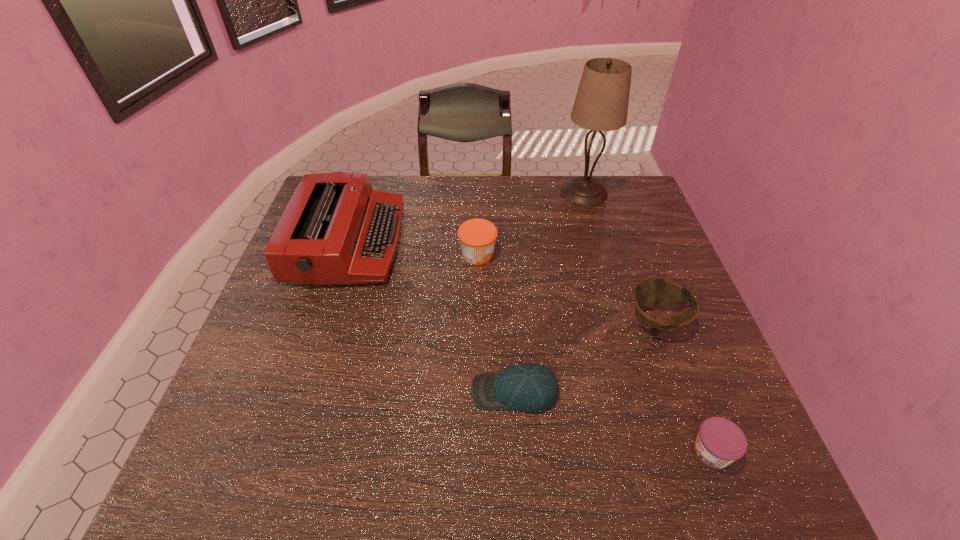
Image resolution: width=960 pixels, height=540 pixels. I want to click on vacant region at the right edge of the desktop, so click(x=676, y=346).

The image size is (960, 540). I want to click on vacant space at the near left corner of the desktop, so click(217, 471).

Where is `blank space at the far right corner`? The image size is (960, 540). blank space at the far right corner is located at coordinates (614, 179).

Identify the location of vacant area that lies between the right jam and the left jam. The image size is (960, 540). (594, 353).

Where is `vacant space that's between the fourth shortest object and the baseball cap`? This screenshot has height=540, width=960. vacant space that's between the fourth shortest object and the baseball cap is located at coordinates (496, 323).

The image size is (960, 540). I want to click on free space between the lampshade and the fifth farthest object, so click(549, 292).

Find the location of `free space between the shorter jam and the leftmost object`. free space between the shorter jam and the leftmost object is located at coordinates (530, 347).

This screenshot has width=960, height=540. I want to click on blank region between the typewriter and the nearest object, so click(x=530, y=347).

At what (x,y) coordinates should I click in order to perform the action: click on free space between the nearest object and the typewriter. Please return your answer as a coordinate pair (x, y). This screenshot has width=960, height=540. Looking at the image, I should click on (530, 347).

Find the location of a particular element. This screenshot has width=960, height=540. empty space that is in between the typewriter and the bowl is located at coordinates (503, 281).